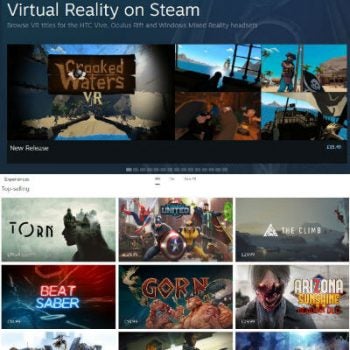
Locate an element on the screen. This screenshot has height=350, width=350. neon lights is located at coordinates (57, 289), (57, 305).